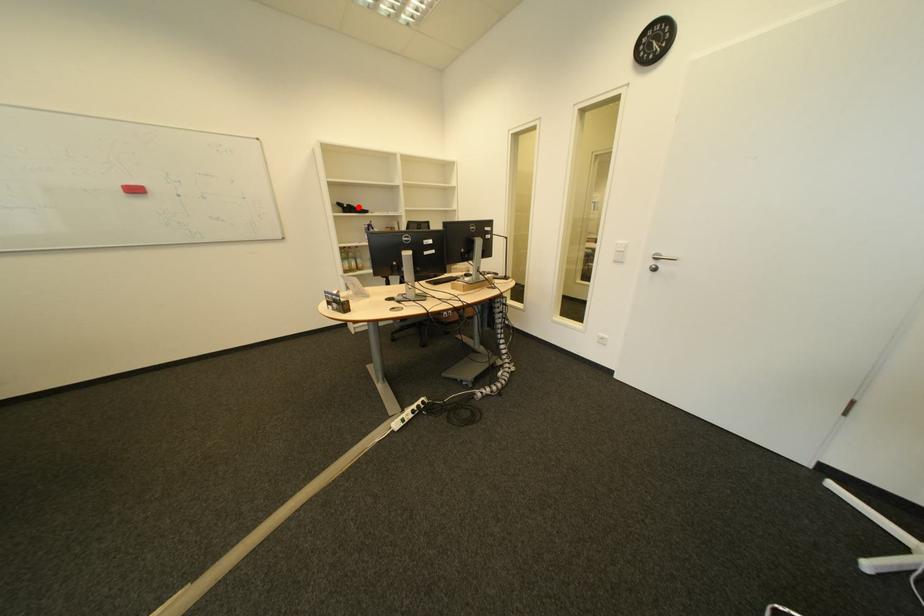
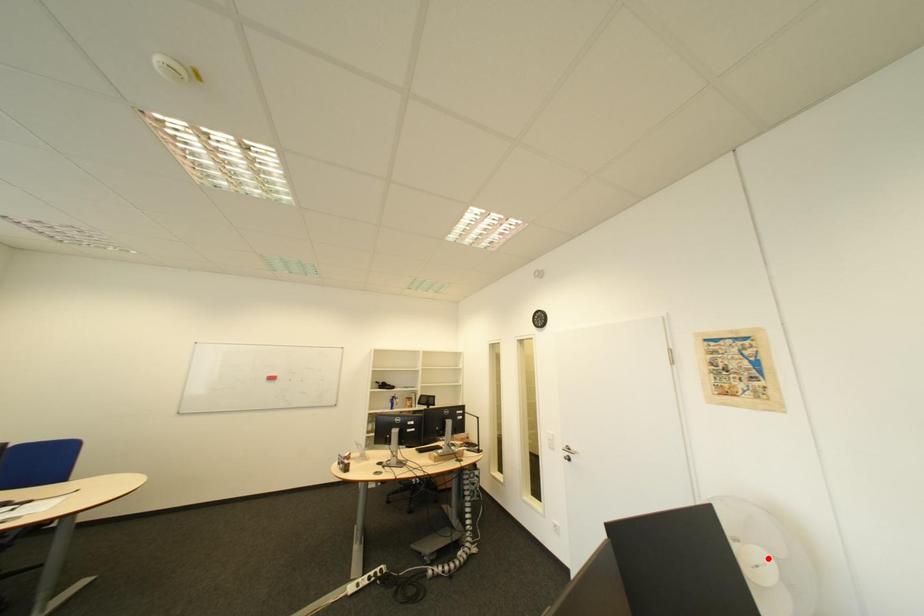
I am providing you with two images of the same scene from different viewpoints. A red point is marked on the first image and another point is marked on the second image. Is the red point in image1 aligned with the point shown in image2?

No